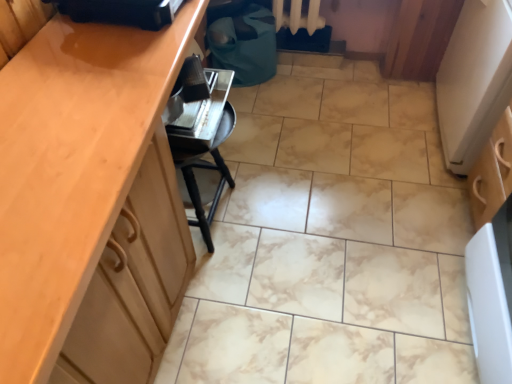
Question: From the image's perspective, does black plastic bag at upper center, the 1th appliance when ordered from front to back, appear higher than white textured radiator at upper center?

Choices:
 (A) no
 (B) yes

Answer: (A)

Question: Is black plastic bag at upper center, the 1th appliance when ordered from front to back, behind white textured radiator at upper center?

Choices:
 (A) yes
 (B) no

Answer: (B)

Question: Are black plastic bag at upper center, the 1th appliance when ordered from front to back, and white textured radiator at upper center located far from each other?

Choices:
 (A) yes
 (B) no

Answer: (A)

Question: Is black plastic bag at upper center, acting as the second appliance starting from the back, thinner than white textured radiator at upper center?

Choices:
 (A) no
 (B) yes

Answer: (A)

Question: Is black plastic bag at upper center, acting as the second appliance starting from the back, in front of white textured radiator at upper center?

Choices:
 (A) yes
 (B) no

Answer: (A)

Question: Considering the relative sizes of black plastic bag at upper center, the 1th appliance when ordered from front to back, and white textured radiator at upper center in the image provided, is black plastic bag at upper center, the 1th appliance when ordered from front to back, bigger than white textured radiator at upper center?

Choices:
 (A) no
 (B) yes

Answer: (A)

Question: Is matte wood cabinet at left shorter than metallic silver toaster at lower center, the 2th appliance when ordered from front to back?

Choices:
 (A) yes
 (B) no

Answer: (B)

Question: Can you confirm if matte wood cabinet at left is bigger than metallic silver toaster at lower center, the first appliance viewed from the back?

Choices:
 (A) yes
 (B) no

Answer: (A)

Question: Considering the relative sizes of matte wood cabinet at left and metallic silver toaster at lower center, the first appliance viewed from the back, in the image provided, is matte wood cabinet at left wider than metallic silver toaster at lower center, the first appliance viewed from the back,?

Choices:
 (A) yes
 (B) no

Answer: (A)

Question: Considering the relative sizes of matte wood cabinet at left and metallic silver toaster at lower center, the 2th appliance when ordered from front to back, in the image provided, is matte wood cabinet at left smaller than metallic silver toaster at lower center, the 2th appliance when ordered from front to back,?

Choices:
 (A) yes
 (B) no

Answer: (B)

Question: Considering the relative sizes of matte wood cabinet at left and metallic silver toaster at lower center, the first appliance viewed from the back, in the image provided, is matte wood cabinet at left thinner than metallic silver toaster at lower center, the first appliance viewed from the back,?

Choices:
 (A) no
 (B) yes

Answer: (A)

Question: From a real-world perspective, is matte wood cabinet at left over metallic silver toaster at lower center, the first appliance viewed from the back?

Choices:
 (A) no
 (B) yes

Answer: (A)

Question: From a real-world perspective, is white textured radiator at upper center physically above matte wood cabinet at left?

Choices:
 (A) yes
 (B) no

Answer: (B)